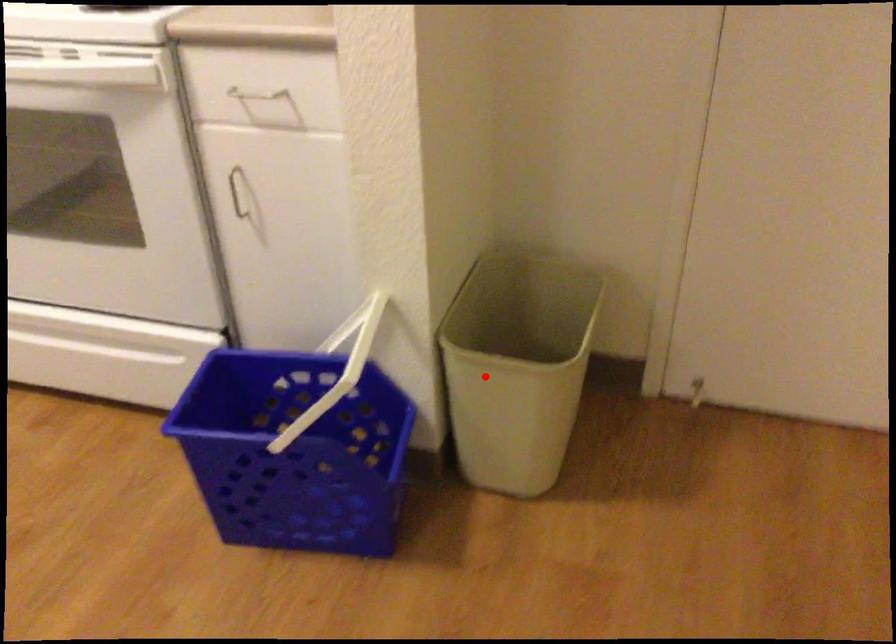
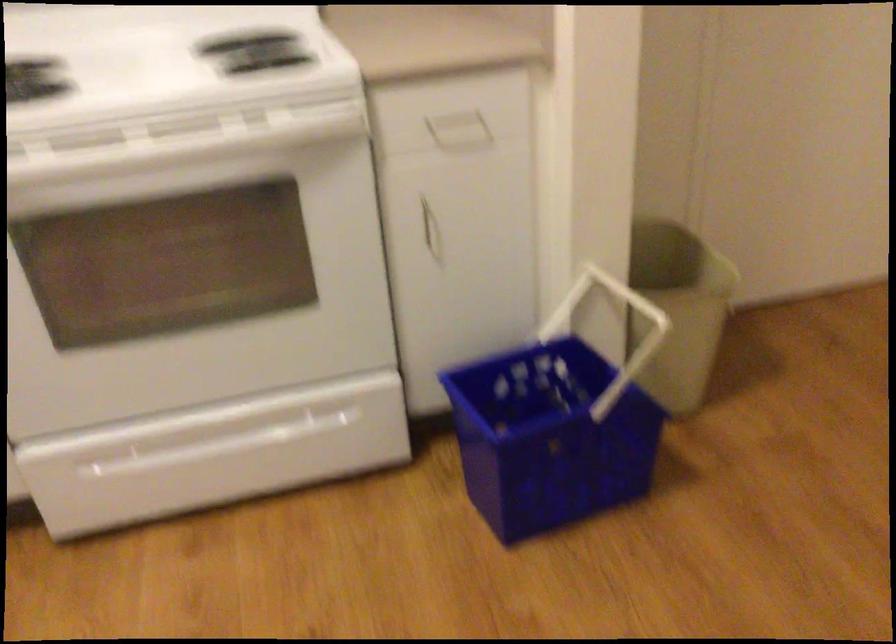
Where in the second image is the point corresponding to the highlighted location from the first image?

(678, 308)